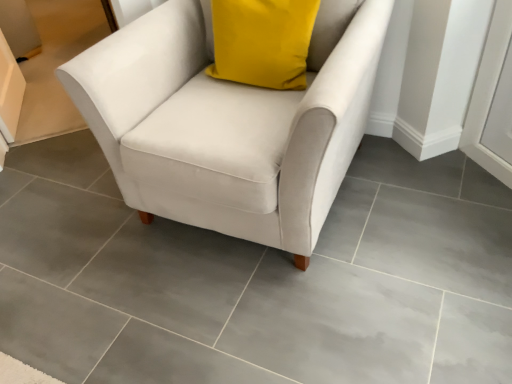
Find the location of `white fabric chair at center`. white fabric chair at center is located at coordinates (229, 122).

What do you see at coordinates (229, 122) in the screenshot? I see `white fabric chair at center` at bounding box center [229, 122].

The width and height of the screenshot is (512, 384). Identify the location of white fabric chair at center. (229, 122).